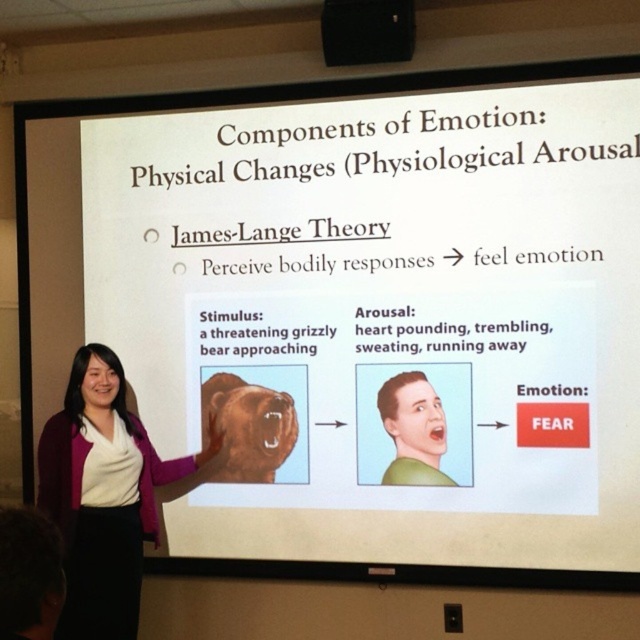
Question: Can you confirm if matte purple sweater at center is positioned below black plastic projector at upper center?

Choices:
 (A) yes
 (B) no

Answer: (A)

Question: Can you confirm if matte purple sweater at center is positioned to the left of black plastic projector at upper center?

Choices:
 (A) no
 (B) yes

Answer: (B)

Question: Which object is positioned farthest from the matte purple sweater at center?

Choices:
 (A) black plastic projector at upper center
 (B) green matte face at center

Answer: (A)

Question: Among these points, which one is nearest to the camera?

Choices:
 (A) (436, 465)
 (B) (58, 493)
 (C) (387, 60)

Answer: (B)

Question: Can you confirm if matte purple sweater at center is positioned to the right of black plastic projector at upper center?

Choices:
 (A) yes
 (B) no

Answer: (B)

Question: Which of these objects is positioned farthest from the matte purple sweater at center?

Choices:
 (A) black plastic projector at upper center
 (B) green matte face at center

Answer: (A)